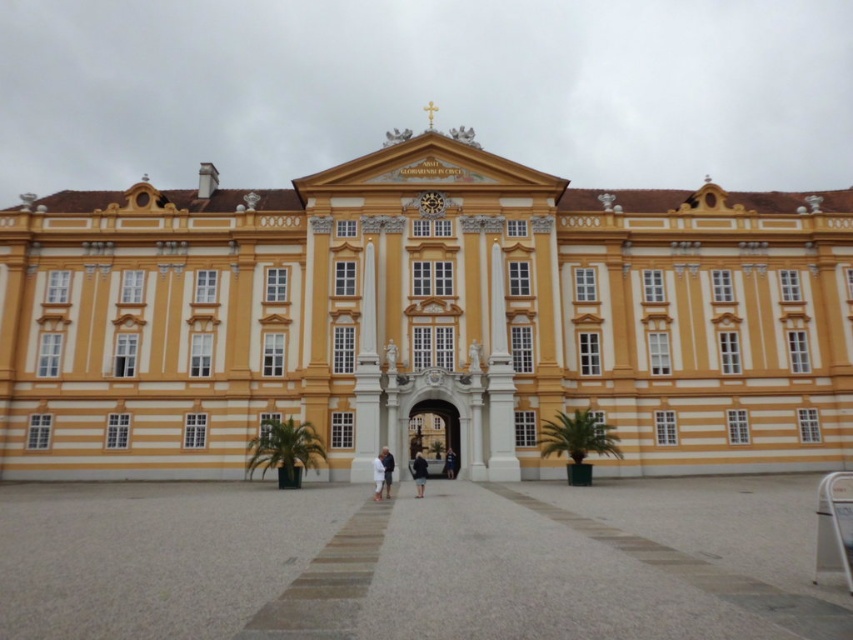
You are a tourist visiting the grand building and need to place your dark blue coat at center on the gray concrete plaza at center. Can you confirm if the plaza has enough space to accommodate your coat?

The gray concrete plaza at center has a larger size compared to dark blue coat at center, so yes, the plaza has enough space to accommodate the coat.

You are standing at the entrance of the grand building and want to take a photo of the point at coordinates (836, 333). If your camera has a maximum zoom range of 50 meters, will you be able to capture the point clearly in your photo?

The point at coordinates (836, 333) is 69.58 meters away from the camera. Since the camera can only zoom up to 50 meters, it won not be able to capture the point clearly.